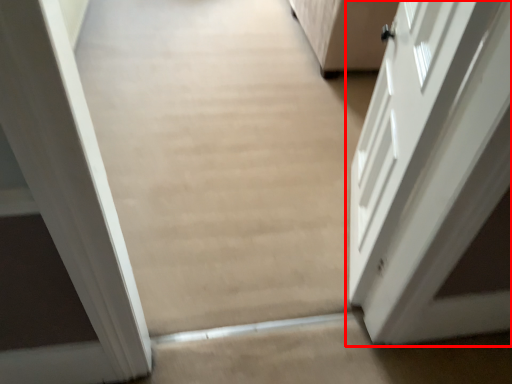
Question: From the image's perspective, considering the relative positions of door (annotated by the red box) and plain in the image provided, where is door (annotated by the red box) located with respect to the staircase?

Choices:
 (A) above
 (B) below

Answer: (A)